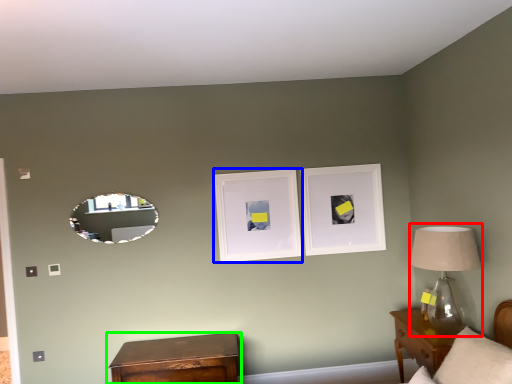
Question: Estimate the real-world distances between objects in this image. Which object is farther from table lamp (highlighted by a red box), picture frame (highlighted by a blue box) or nightstand (highlighted by a green box)?

Choices:
 (A) picture frame
 (B) nightstand

Answer: (B)